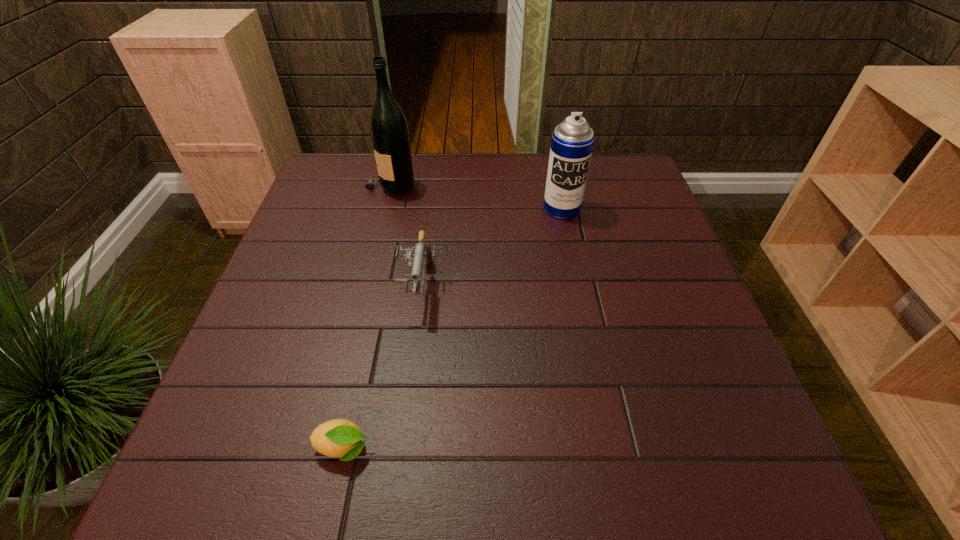
Identify the location of free area in between the lemon and the rightmost object. This screenshot has width=960, height=540. (452, 328).

Identify the location of empty space that is in between the shortest object and the third tallest object. (381, 367).

Identify the location of free point between the second shortest object and the lemon. (381, 367).

Where is `free space that is in between the lemon and the wine bottle`? The image size is (960, 540). free space that is in between the lemon and the wine bottle is located at coordinates (367, 316).

Image resolution: width=960 pixels, height=540 pixels. Identify the location of vacant space that's between the farthest object and the third shortest object. (476, 196).

The width and height of the screenshot is (960, 540). What are the coordinates of `free point between the third tallest object and the farthest object` in the screenshot? It's located at (404, 235).

At what (x,y) coordinates should I click in order to perform the action: click on vacant area that lies between the shortest object and the tallest object. Please return your answer as a coordinate pair (x, y). The width and height of the screenshot is (960, 540). Looking at the image, I should click on (367, 316).

Where is `free point between the lemon and the third shortest object`? The width and height of the screenshot is (960, 540). free point between the lemon and the third shortest object is located at coordinates (452, 328).

What are the coordinates of `free space between the gun and the tallest object` in the screenshot? It's located at (404, 235).

What are the coordinates of `vacant space that is in between the farthest object and the second nearest object` in the screenshot? It's located at [x=404, y=235].